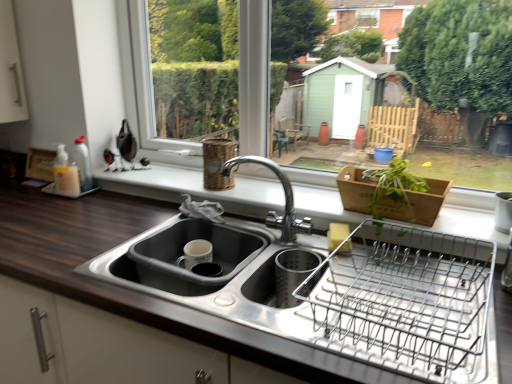
What is the approximate width of metallic wire dish rack at right?

It is 20.08 inches.

I want to click on metallic wire dish rack at right, so click(406, 300).

What do you see at coordinates (218, 163) in the screenshot?
I see `woven brown basket at upper center` at bounding box center [218, 163].

Find the location of a particular element. This screenshot has width=512, height=384. dark wood countertop at center is located at coordinates (104, 251).

Measure the distance between white plastic window frame at upper center and camera.

white plastic window frame at upper center is 1.56 meters away from camera.

Where is `white plastic window frame at upper center`? white plastic window frame at upper center is located at coordinates (417, 97).

Find the location of a particular element. The width and height of the screenshot is (512, 384). metallic wire dish rack at right is located at coordinates (406, 300).

Which point is more distant from viewer, (167, 264) or (309, 222)?

The point (309, 222) is farther.

Which of these two, matte gray sink at lower center or chrome metallic faucet at center, is wider?

Wider between the two is matte gray sink at lower center.

From the image's perspective, which one is positioned lower, matte gray sink at lower center or chrome metallic faucet at center?

matte gray sink at lower center is shown below in the image.

Which object is further away from the camera taking this photo, matte gray sink at lower center or chrome metallic faucet at center?

matte gray sink at lower center is further away from the camera.

From the image's perspective, does white plastic window frame at upper center appear higher than wooden basket at center?

Yes.

Is wooden basket at center a part of white plastic window frame at upper center?

No, wooden basket at center is located outside of white plastic window frame at upper center.

Can you confirm if white plastic window frame at upper center is positioned to the left of wooden basket at center?

Incorrect, white plastic window frame at upper center is not on the left side of wooden basket at center.

In terms of height, does wooden basket at center look taller or shorter compared to dark wood countertop at center?

wooden basket at center is shorter than dark wood countertop at center.

Is wooden basket at center aimed at dark wood countertop at center?

Yes, wooden basket at center is oriented towards dark wood countertop at center.

Is wooden basket at center to the left or to the right of dark wood countertop at center in the image?

Based on their positions, wooden basket at center is located to the right of dark wood countertop at center.

From the image's perspective, does wooden basket at center appear higher than dark wood countertop at center?

Yes, from the image's perspective, wooden basket at center is above dark wood countertop at center.

Can you tell me how much woven brown basket at upper center and dark wood countertop at center differ in facing direction?

2.93 degrees.

Is point (230, 155) closer to camera compared to point (123, 227)?

No, (230, 155) is behind (123, 227).

From the image's perspective, which one is positioned higher, woven brown basket at upper center or dark wood countertop at center?

woven brown basket at upper center appears higher in the image.

Between dark wood countertop at center and metallic wire dish rack at right, which one has larger size?

dark wood countertop at center is bigger.

Is dark wood countertop at center oriented away from metallic wire dish rack at right?

That's not correct — dark wood countertop at center is not looking away from metallic wire dish rack at right.

From the image's perspective, between dark wood countertop at center and metallic wire dish rack at right, which one is located above?

metallic wire dish rack at right.

Can you see dark wood countertop at center touching metallic wire dish rack at right?

dark wood countertop at center and metallic wire dish rack at right are not in contact.

Is matte gray sink at lower center at the back of dark wood countertop at center?

Absolutely, dark wood countertop at center is directed away from matte gray sink at lower center.

This screenshot has height=384, width=512. Identify the location of sink positioned vertically above the dark wood countertop at center (from a real-world perspective). tap(183, 255).

From a real-world perspective, is dark wood countertop at center positioned above or below matte gray sink at lower center?

In terms of real-world spatial position, dark wood countertop at center is below matte gray sink at lower center.

From a real-world perspective, who is located higher, metallic wire dish rack at right or white plastic window frame at upper center?

In real-world perspective, white plastic window frame at upper center is above.

Locate an element on the screen. window frame behind the metallic wire dish rack at right is located at coordinates (417, 97).

Can you confirm if metallic wire dish rack at right is smaller than white plastic window frame at upper center?

Yes.

Considering the positions of objects metallic wire dish rack at right and white plastic window frame at upper center in the image provided, who is behind, metallic wire dish rack at right or white plastic window frame at upper center?

white plastic window frame at upper center is further from the camera.

In order to click on tap on the right of the matte gray sink at lower center in this screenshot , I will do `click(285, 200)`.

At what (x,y) coordinates should I click in order to perform the action: click on window frame that is above the wooden basket at center (from a real-world perspective). Please return your answer as a coordinate pair (x, y). Image resolution: width=512 pixels, height=384 pixels. Looking at the image, I should click on (417, 97).

Looking at the image, which one is located closer to woven brown basket at upper center, white plastic window frame at upper center or matte gray sink at lower center?

The object closer to woven brown basket at upper center is matte gray sink at lower center.

Which object lies nearer to the anchor point metallic wire dish rack at right, white plastic window frame at upper center or matte gray sink at lower center?

The object closer to metallic wire dish rack at right is matte gray sink at lower center.

Looking at the image, which one is located further to dark wood countertop at center, matte gray sink at lower center or metallic wire dish rack at right?

metallic wire dish rack at right is positioned further to the anchor dark wood countertop at center.

Which object lies further to the anchor point dark wood countertop at center, white plastic window frame at upper center or chrome metallic faucet at center?

The object further to dark wood countertop at center is white plastic window frame at upper center.

Estimate the real-world distances between objects in this image. Which object is further from dark wood countertop at center, metallic wire dish rack at right or chrome metallic faucet at center?

chrome metallic faucet at center lies further to dark wood countertop at center than the other object.

Looking at the image, which one is located further to woven brown basket at upper center, metallic wire dish rack at right or wooden basket at center?

metallic wire dish rack at right lies further to woven brown basket at upper center than the other object.

Which object lies nearer to the anchor point chrome metallic faucet at center, woven brown basket at upper center or wooden basket at center?

The object closer to chrome metallic faucet at center is woven brown basket at upper center.

When comparing their distances from chrome metallic faucet at center, does wooden basket at center or white plastic window frame at upper center seem further?

white plastic window frame at upper center is further to chrome metallic faucet at center.

Locate an element on the screen. The width and height of the screenshot is (512, 384). window sill that lies between white plastic window frame at upper center and matte gray sink at lower center from top to bottom is located at coordinates (197, 188).

You are a GUI agent. You are given a task and a screenshot of the screen. Output one action in this format:
    pyautogui.click(x=<x>, y=<y>)
    Task: Click on the window sill between white plastic window frame at upper center and metallic wire dish rack at right in the vertical direction
    
    Given the screenshot: What is the action you would take?
    pyautogui.click(x=197, y=188)

Identify the location of tap located between dark wood countertop at center and woven brown basket at upper center in the depth direction. (285, 200).

This screenshot has width=512, height=384. I want to click on sink between dark wood countertop at center and woven brown basket at upper center along the z-axis, so click(183, 255).